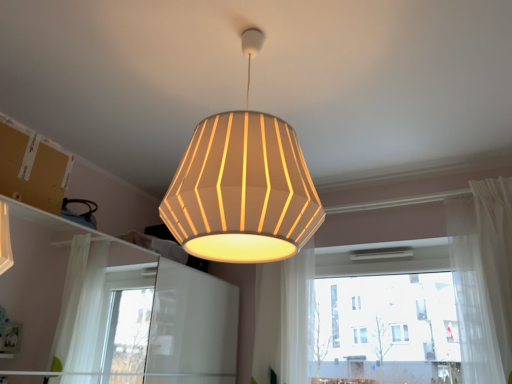
Question: Considering the positions of white sheer curtain at center, which is counted as the second curtain, starting from the right, and white glass window at center in the image, is white sheer curtain at center, which is counted as the second curtain, starting from the right, wider or thinner than white glass window at center?

Choices:
 (A) thin
 (B) wide

Answer: (B)

Question: Would you say white sheer curtain at center, which is counted as the second curtain, starting from the right, is to the left or to the right of white glass window at center in the picture?

Choices:
 (A) left
 (B) right

Answer: (A)

Question: Which of these objects is positioned closest to the white sheer curtain at center, the 1th curtain when ordered from left to right?

Choices:
 (A) brown cardboard at upper left
 (B) white sheer curtain at right, which is the first curtain in right-to-left order
 (C) white glass window at center
 (D) matte white lampshade at center

Answer: (C)

Question: Considering the real-world distances, which object is farthest from the matte white lampshade at center?

Choices:
 (A) white glass window at center
 (B) white sheer curtain at center, which is counted as the second curtain, starting from the right
 (C) brown cardboard at upper left
 (D) white sheer curtain at right, the second curtain viewed from the left

Answer: (A)